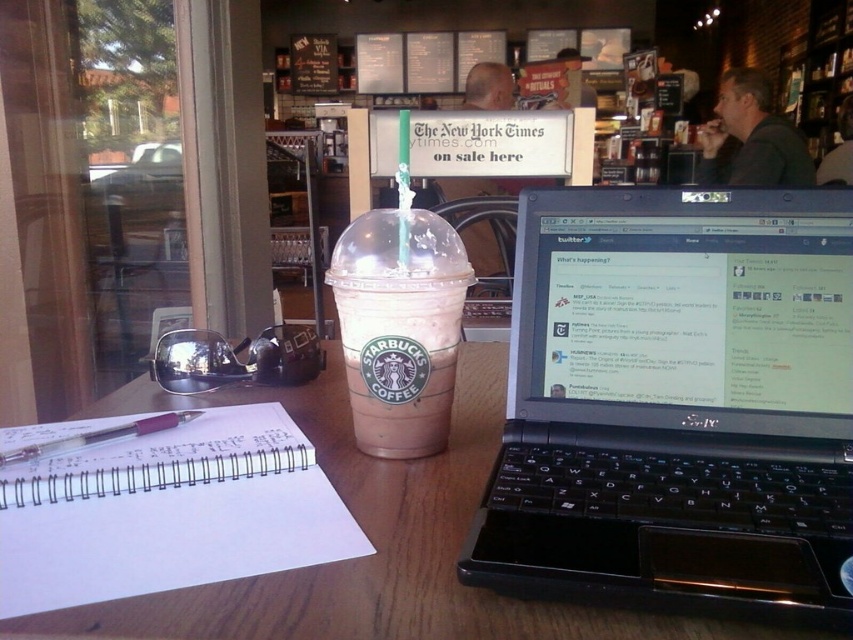
Question: Does white spiral notebook at center appear over translucent plastic pen at lower left?

Choices:
 (A) no
 (B) yes

Answer: (A)

Question: Estimate the real-world distances between objects in this image. Which object is farther from the black plastic laptop at center?

Choices:
 (A) wooden table at center
 (B) pink frosted cup at center
 (C) white spiral notebook at center
 (D) translucent plastic pen at lower left

Answer: (D)

Question: Does wooden table at center appear on the left side of translucent plastic pen at lower left?

Choices:
 (A) no
 (B) yes

Answer: (A)

Question: Among these points, which one is farthest from the camera?

Choices:
 (A) (279, 600)
 (B) (10, 456)

Answer: (B)

Question: Among these points, which one is nearest to the camera?

Choices:
 (A) (105, 440)
 (B) (416, 387)
 (C) (56, 524)
 (D) (312, 580)

Answer: (D)

Question: Is black plastic laptop at center in front of wooden table at center?

Choices:
 (A) yes
 (B) no

Answer: (B)